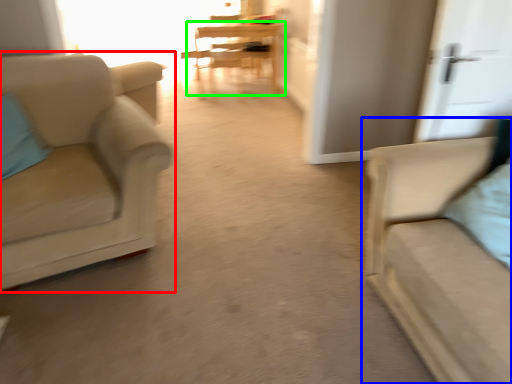
Question: Considering the real-world distances, which object is farthest from chair (highlighted by a red box)? studio couch (highlighted by a blue box) or table (highlighted by a green box)?

Choices:
 (A) studio couch
 (B) table

Answer: (B)